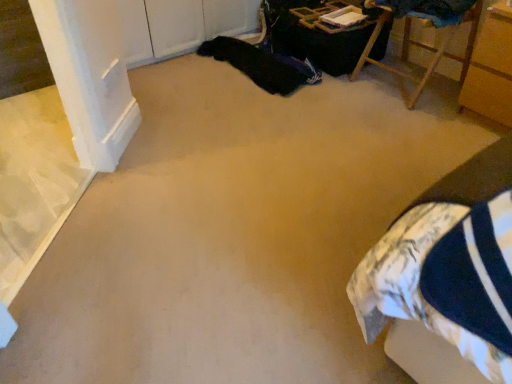
Question: Considering the relative positions of black fabric at upper center and wooden cabinet at right, the 1th furniture in the right-to-left sequence, in the image provided, is black fabric at upper center to the left of wooden cabinet at right, the 1th furniture in the right-to-left sequence, from the viewer's perspective?

Choices:
 (A) no
 (B) yes

Answer: (B)

Question: Is black fabric at upper center bigger than wooden cabinet at right, which is counted as the 2th furniture, starting from the left?

Choices:
 (A) yes
 (B) no

Answer: (B)

Question: From the image's perspective, is black fabric at upper center beneath wooden cabinet at right, which is counted as the 2th furniture, starting from the left?

Choices:
 (A) yes
 (B) no

Answer: (B)

Question: Is black fabric at upper center beside wooden cabinet at right, which is counted as the 2th furniture, starting from the left?

Choices:
 (A) no
 (B) yes

Answer: (A)

Question: Is black fabric at upper center closer to camera compared to wooden cabinet at right, the 1th furniture in the right-to-left sequence?

Choices:
 (A) no
 (B) yes

Answer: (A)

Question: From the image's perspective, relative to wooden chair at upper right, which is the first furniture in left-to-right order, is wooden cabinet at right, the 1th furniture in the right-to-left sequence, above or below?

Choices:
 (A) above
 (B) below

Answer: (B)

Question: In terms of height, does wooden cabinet at right, which is counted as the 2th furniture, starting from the left, look taller or shorter compared to wooden chair at upper right, the second furniture in the right-to-left sequence?

Choices:
 (A) tall
 (B) short

Answer: (A)

Question: In terms of size, does wooden cabinet at right, the 1th furniture in the right-to-left sequence, appear bigger or smaller than wooden chair at upper right, which is the first furniture in left-to-right order?

Choices:
 (A) small
 (B) big

Answer: (A)

Question: In the image, is wooden cabinet at right, the 1th furniture in the right-to-left sequence, on the left side or the right side of wooden chair at upper right, the second furniture in the right-to-left sequence?

Choices:
 (A) left
 (B) right

Answer: (B)

Question: From their relative heights in the image, would you say black fabric at upper center is taller or shorter than wooden chair at upper right, which is the first furniture in left-to-right order?

Choices:
 (A) tall
 (B) short

Answer: (B)

Question: Considering the positions of point (300, 74) and point (442, 51), is point (300, 74) closer or farther from the camera than point (442, 51)?

Choices:
 (A) closer
 (B) farther

Answer: (B)

Question: Is black fabric at upper center inside the boundaries of wooden chair at upper right, which is the first furniture in left-to-right order, or outside?

Choices:
 (A) outside
 (B) inside

Answer: (A)

Question: Based on their positions, is black fabric at upper center located to the left or right of wooden chair at upper right, which is the first furniture in left-to-right order?

Choices:
 (A) left
 (B) right

Answer: (A)

Question: Considering the positions of wooden chair at upper right, which is the first furniture in left-to-right order, and wooden cabinet at right, which is counted as the 2th furniture, starting from the left, in the image, is wooden chair at upper right, which is the first furniture in left-to-right order, bigger or smaller than wooden cabinet at right, which is counted as the 2th furniture, starting from the left,?

Choices:
 (A) big
 (B) small

Answer: (A)

Question: From the image's perspective, is wooden chair at upper right, the second furniture in the right-to-left sequence, located above or below wooden cabinet at right, the 1th furniture in the right-to-left sequence?

Choices:
 (A) above
 (B) below

Answer: (A)